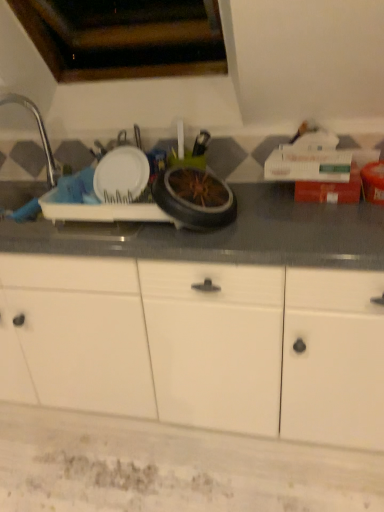
Measure the distance between white matte cabinet at center and camera.

white matte cabinet at center is 3.72 feet away from camera.

Locate an element on the screen. Image resolution: width=384 pixels, height=512 pixels. white matte cabinet at center is located at coordinates (x=198, y=344).

The image size is (384, 512). What do you see at coordinates (198, 344) in the screenshot?
I see `white matte cabinet at center` at bounding box center [198, 344].

What is the approximate width of silver metallic faucet at left?

silver metallic faucet at left is 7.48 inches in width.

The image size is (384, 512). In order to click on silver metallic faucet at left in this screenshot , I will do `click(39, 132)`.

The height and width of the screenshot is (512, 384). Describe the element at coordinates (39, 132) in the screenshot. I see `silver metallic faucet at left` at that location.

This screenshot has width=384, height=512. Identify the location of white matte cabinet at center. 198,344.

Visually, is white matte cabinet at center positioned to the left or to the right of silver metallic faucet at left?

From the image, it's evident that white matte cabinet at center is to the right of silver metallic faucet at left.

Is white matte cabinet at center in front of silver metallic faucet at left?

Yes, it is.

Does point (350, 428) appear closer or farther from the camera than point (1, 97)?

Clearly, point (350, 428) is closer to the camera than point (1, 97).

From the image's perspective, is white matte cabinet at center above or below silver metallic faucet at left?

Based on their image positions, white matte cabinet at center is located beneath silver metallic faucet at left.

From a real-world perspective, between white matte cabinet at center and silver metallic faucet at left, who is vertically lower?

In real-world perspective, white matte cabinet at center is lower.

Which of these two, white matte cabinet at center or silver metallic faucet at left, is thinner?

silver metallic faucet at left is thinner.

Between white matte cabinet at center and silver metallic faucet at left, which one has less height?

Standing shorter between the two is silver metallic faucet at left.

From the picture: Between white matte cabinet at center and silver metallic faucet at left, which one has smaller size?

With smaller size is silver metallic faucet at left.

Could silver metallic faucet at left be considered to be inside white matte cabinet at center?

No, silver metallic faucet at left is not surrounded by white matte cabinet at center.

Is white matte cabinet at center beside silver metallic faucet at left?

No, white matte cabinet at center is not in contact with silver metallic faucet at left.

Is white matte cabinet at center positioned with its back to silver metallic faucet at left?

No, white matte cabinet at center's orientation is not away from silver metallic faucet at left.

Measure the distance from white matte cabinet at center to silver metallic faucet at left.

A distance of 36.17 inches exists between white matte cabinet at center and silver metallic faucet at left.

Locate an element on the screen. faucet behind the white matte cabinet at center is located at coordinates (39, 132).

Can you confirm if silver metallic faucet at left is positioned to the right of white matte cabinet at center?

No.

Relative to white matte cabinet at center, is silver metallic faucet at left in front or behind?

In the image, silver metallic faucet at left appears behind white matte cabinet at center.

Which is farther, (50, 180) or (118, 406)?

The point (50, 180) is behind.

From the image's perspective, which is above, silver metallic faucet at left or white matte cabinet at center?

silver metallic faucet at left appears higher in the image.

From a real-world perspective, who is located higher, silver metallic faucet at left or white matte cabinet at center?

silver metallic faucet at left, from a real-world perspective.

Considering the sizes of objects silver metallic faucet at left and white matte cabinet at center in the image provided, who is thinner, silver metallic faucet at left or white matte cabinet at center?

Thinner between the two is silver metallic faucet at left.

From their relative heights in the image, would you say silver metallic faucet at left is taller or shorter than white matte cabinet at center?

Considering their sizes, silver metallic faucet at left has less height than white matte cabinet at center.

Considering the relative sizes of silver metallic faucet at left and white matte cabinet at center in the image provided, is silver metallic faucet at left bigger than white matte cabinet at center?

Actually, silver metallic faucet at left might be smaller than white matte cabinet at center.

Is silver metallic faucet at left outside of white matte cabinet at center?

silver metallic faucet at left is positioned outside white matte cabinet at center.

Is silver metallic faucet at left positioned far away from white matte cabinet at center?

silver metallic faucet at left is actually quite close to white matte cabinet at center.

Could you tell me if silver metallic faucet at left is turned towards white matte cabinet at center?

No, silver metallic faucet at left is not oriented towards white matte cabinet at center.

What's the angular difference between silver metallic faucet at left and white matte cabinet at center's facing directions?

They differ by 1.58 degrees in their facing directions.

In the image, there is a silver metallic faucet at left. Where is `cabinetry below it (from a real-world perspective)`? cabinetry below it (from a real-world perspective) is located at coordinates (198, 344).

Where is `faucet behind the white matte cabinet at center`? faucet behind the white matte cabinet at center is located at coordinates (39, 132).

Where is `cabinetry located underneath the silver metallic faucet at left (from a real-world perspective)`? cabinetry located underneath the silver metallic faucet at left (from a real-world perspective) is located at coordinates (198, 344).